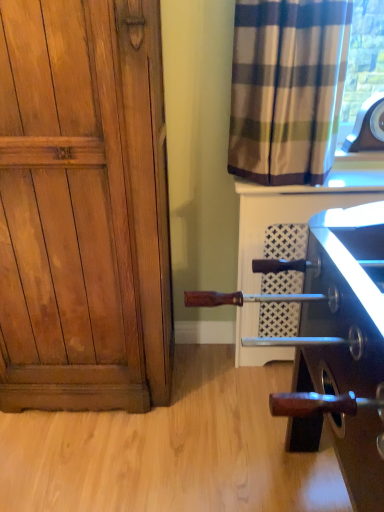
Question: Would you say plaid fabric curtain at upper right is inside or outside white textured tile at upper right?

Choices:
 (A) inside
 (B) outside

Answer: (B)

Question: Looking at the image, does plaid fabric curtain at upper right seem bigger or smaller compared to white textured tile at upper right?

Choices:
 (A) small
 (B) big

Answer: (B)

Question: Which object is the closest to the wooden paneling at left?

Choices:
 (A) plaid fabric curtain at upper right
 (B) white textured tile at upper right
 (C) wooden handle at lower right

Answer: (C)

Question: Which object is positioned farthest from the white textured tile at upper right?

Choices:
 (A) plaid fabric curtain at upper right
 (B) wooden handle at lower right
 (C) wooden paneling at left

Answer: (B)